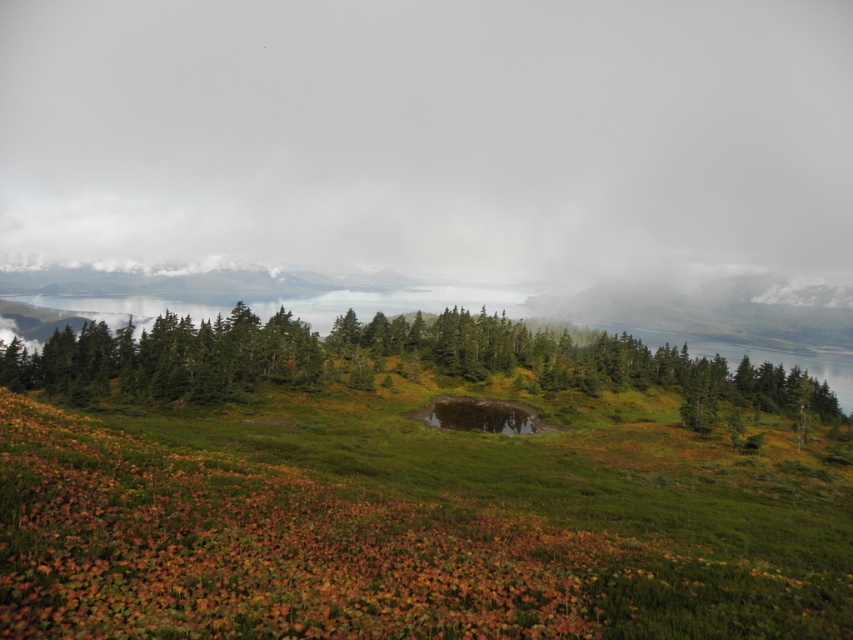
You are standing at the origin point in the scene. Which direction should you move to reach the green grassy at center?

The green grassy at center is located at point 0.822 on the x axis and 0.479 on the y axis, so you should move towards the right and slightly forward to reach it.

You are a photographer aiming to capture the entire scene in one shot. Given that your camera can only focus on objects wider than the green grassy at center, will the white fluffy cloud at upper center be in focus?

The white fluffy cloud at upper center is wider than the green grassy at center, so it will be in focus as it meets the camera focus requirement.

You are planning to take a photo of the white fluffy cloud at upper center and the green matte trees at center. Which object will appear bigger in the photo?

The white fluffy cloud at upper center will appear bigger in the photo because it has a larger size compared to the green matte trees at center according to the description.